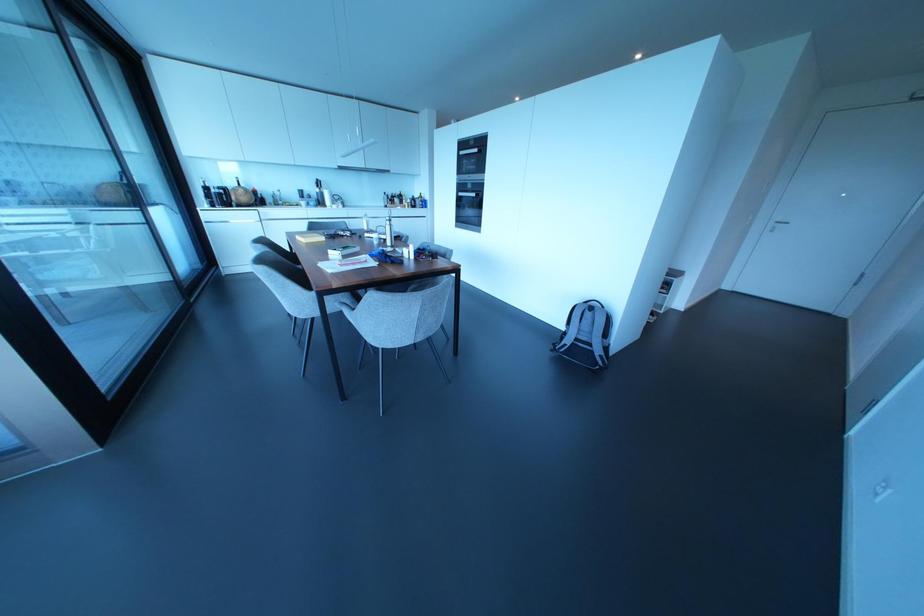
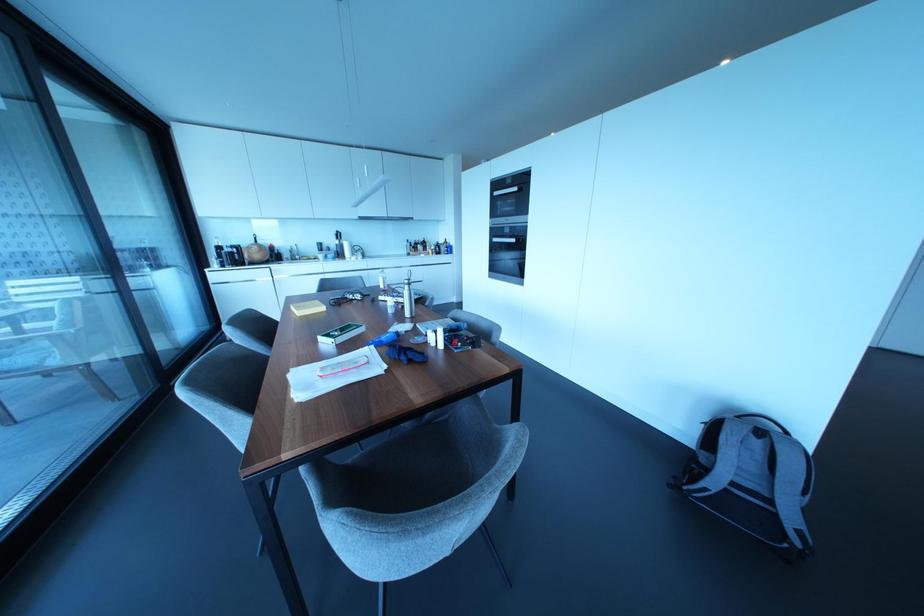
Question: What movement of the cameraman would produce the second image?

Choices:
 (A) Left
 (B) Right
 (C) Forward
 (D) Backward

Answer: (C)